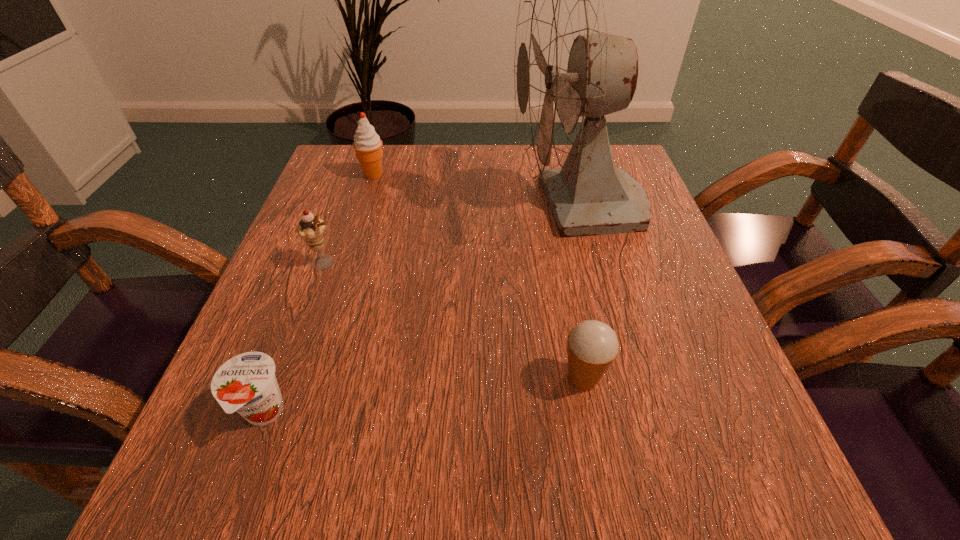
Image resolution: width=960 pixels, height=540 pixels. Find the location of `free spot located on the right of the second farthest icecream`. free spot located on the right of the second farthest icecream is located at coordinates (454, 262).

Find the location of a particular element. free space located 0.350m on the left of the fourth tallest object is located at coordinates (324, 379).

Locate an element on the screen. The width and height of the screenshot is (960, 540). free space located on the back of the yogurt is located at coordinates (320, 264).

I want to click on fan situated at the far edge, so click(x=569, y=72).

At what (x,y) coordinates should I click in order to perform the action: click on icecream that is at the far edge. Please return your answer as a coordinate pair (x, y). Looking at the image, I should click on (367, 144).

Where is `object at the near edge`? Image resolution: width=960 pixels, height=540 pixels. object at the near edge is located at coordinates (246, 383).

What are the coordinates of `yogurt at the left edge` in the screenshot? It's located at (246, 383).

This screenshot has height=540, width=960. I want to click on object that is at the right edge, so (x=569, y=72).

Locate an element on the screen. The width and height of the screenshot is (960, 540). object present at the far left corner is located at coordinates (367, 144).

Where is `object positioned at the near left corner`? The image size is (960, 540). object positioned at the near left corner is located at coordinates (246, 383).